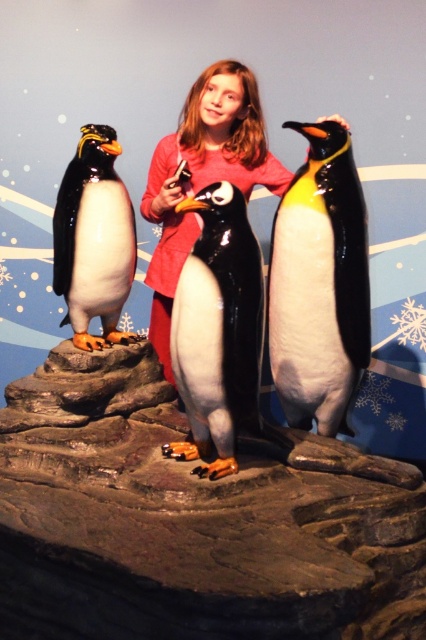
You are a photographer trying to capture the girl in the center without cropping the shiny black penguin at left. Since the matte pink shirt at center is wider than the penguin, will you need to adjust your camera angle to include both?

The matte pink shirt at center is wider than the shiny black penguin at left, so adjusting the camera angle might be necessary to ensure both are fully visible without cropping the penguin.

You are a visitor at an indoor Arctic exhibit and want to place a small souvenir on the smooth gray rock at center or the matte pink shirt at center. Which object can better support the souvenir without it falling over?

The smooth gray rock at center is larger in size than the matte pink shirt at center, so it can better support the souvenir without it falling over.